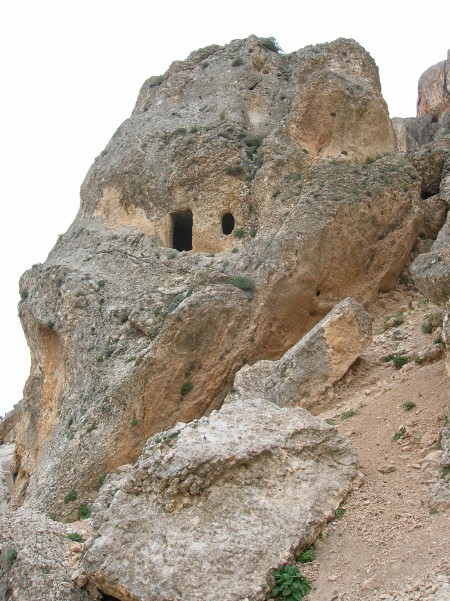
What are the coordinates of `entrance` in the screenshot? It's located at (178, 222).